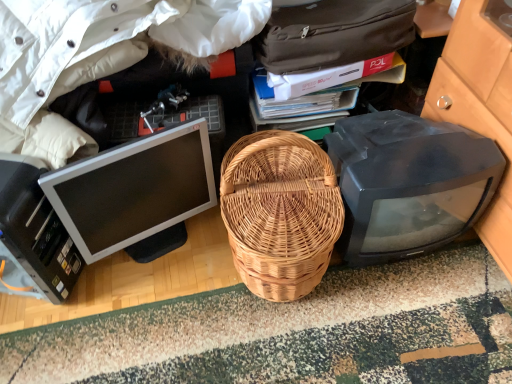
Question: Considering the relative positions of natural wicker picnic basket at center and white cotton jacket at upper left in the image provided, is natural wicker picnic basket at center to the right of white cotton jacket at upper left from the viewer's perspective?

Choices:
 (A) no
 (B) yes

Answer: (B)

Question: Can you confirm if natural wicker picnic basket at center is thinner than white cotton jacket at upper left?

Choices:
 (A) yes
 (B) no

Answer: (A)

Question: Does natural wicker picnic basket at center come behind white cotton jacket at upper left?

Choices:
 (A) no
 (B) yes

Answer: (B)

Question: Are natural wicker picnic basket at center and white cotton jacket at upper left located far from each other?

Choices:
 (A) yes
 (B) no

Answer: (B)

Question: Is natural wicker picnic basket at center directly adjacent to white cotton jacket at upper left?

Choices:
 (A) yes
 (B) no

Answer: (B)

Question: Is matte black monitor at right, which is the 2th computer monitor in left-to-right order, wider or thinner than white cotton jacket at upper left?

Choices:
 (A) wide
 (B) thin

Answer: (B)

Question: From the image's perspective, relative to white cotton jacket at upper left, is matte black monitor at right, the first computer monitor when ordered from right to left, above or below?

Choices:
 (A) above
 (B) below

Answer: (B)

Question: Is matte black monitor at right, the first computer monitor when ordered from right to left, spatially inside white cotton jacket at upper left, or outside of it?

Choices:
 (A) outside
 (B) inside

Answer: (A)

Question: Is point (415, 120) positioned closer to the camera than point (123, 56)?

Choices:
 (A) closer
 (B) farther

Answer: (B)

Question: From the image's perspective, relative to white glossy computer monitor at left, arranged as the second computer monitor when viewed from the right, is white cotton jacket at upper left above or below?

Choices:
 (A) below
 (B) above

Answer: (B)

Question: Is white cotton jacket at upper left to the left or to the right of white glossy computer monitor at left, arranged as the second computer monitor when viewed from the right, in the image?

Choices:
 (A) right
 (B) left

Answer: (B)

Question: Which is correct: white cotton jacket at upper left is inside white glossy computer monitor at left, the 1th computer monitor when ordered from left to right, or outside of it?

Choices:
 (A) outside
 (B) inside

Answer: (A)

Question: Considering the positions of point (243, 3) and point (133, 147), is point (243, 3) closer or farther from the camera than point (133, 147)?

Choices:
 (A) closer
 (B) farther

Answer: (B)

Question: From the image's perspective, is black plastic printer at lower left positioned above or below white glossy computer monitor at left, the 1th computer monitor when ordered from left to right?

Choices:
 (A) below
 (B) above

Answer: (A)

Question: In terms of size, does black plastic printer at lower left appear bigger or smaller than white glossy computer monitor at left, the 1th computer monitor when ordered from left to right?

Choices:
 (A) big
 (B) small

Answer: (A)